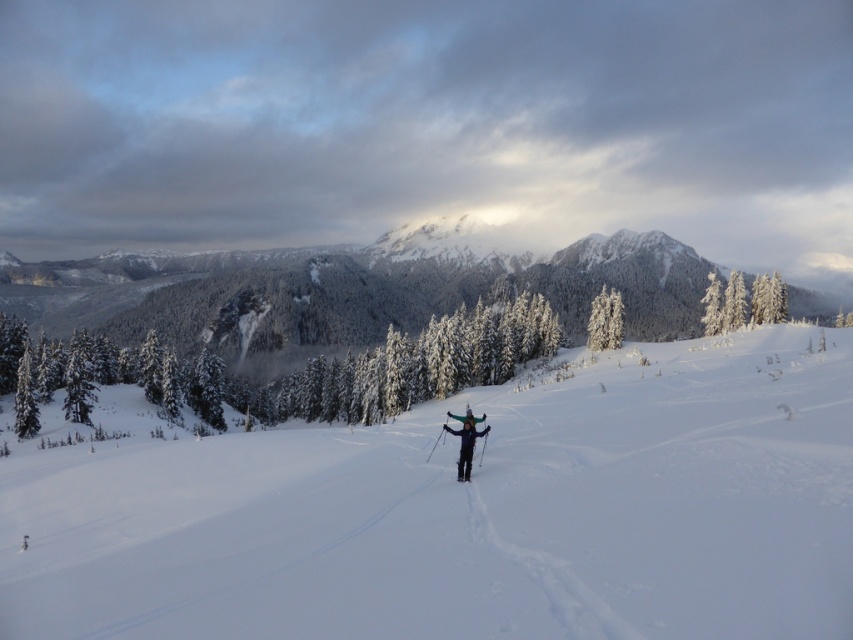
Is white frosty tree at upper right thinner than white frosty tree at upper center?

No, white frosty tree at upper right is not thinner than white frosty tree at upper center.

In the scene shown: Who is positioned more to the left, white frosty tree at upper right or white frosty tree at upper center?

Positioned to the left is white frosty tree at upper center.

Identify the location of white frosty tree at upper right. (724, 304).

Is point (636, 484) positioned after point (770, 291)?

That is False.

Does white snow ski slope at center have a smaller size compared to white frosty tree at upper right?

Actually, white snow ski slope at center might be larger than white frosty tree at upper right.

Does point (79, 625) lie behind point (740, 275)?

No, it is in front of (740, 275).

You are a GUI agent. You are given a task and a screenshot of the screen. Output one action in this format:
    pyautogui.click(x=<x>, y=<y>)
    Task: Click on the white snow ski slope at center
    The width and height of the screenshot is (853, 640).
    Given the screenshot: What is the action you would take?
    pyautogui.click(x=463, y=513)

Who is more distant from viewer, (x=593, y=301) or (x=33, y=406)?

Point (x=593, y=301)

Is white frosty tree at upper center shorter than snow-covered evergreen tree at left?

Incorrect, white frosty tree at upper center's height does not fall short of snow-covered evergreen tree at left's.

Describe the element at coordinates (605, 321) in the screenshot. I see `white frosty tree at upper center` at that location.

You are a GUI agent. You are given a task and a screenshot of the screen. Output one action in this format:
    pyautogui.click(x=<x>, y=<y>)
    Task: Click on the white frosty tree at upper center
    This screenshot has width=853, height=640.
    Given the screenshot: What is the action you would take?
    pyautogui.click(x=605, y=321)